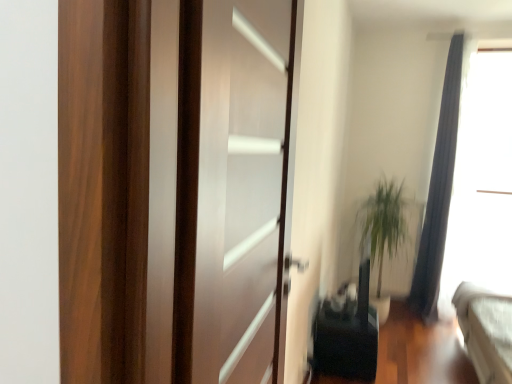
Question: Is green leafy plant at right touching black matte speaker at lower center?

Choices:
 (A) no
 (B) yes

Answer: (A)

Question: Is green leafy plant at right outside of black matte speaker at lower center?

Choices:
 (A) yes
 (B) no

Answer: (A)

Question: Would you say black matte speaker at lower center is part of green leafy plant at right's contents?

Choices:
 (A) yes
 (B) no

Answer: (B)

Question: Can you confirm if green leafy plant at right is shorter than black matte speaker at lower center?

Choices:
 (A) no
 (B) yes

Answer: (A)

Question: From the image's perspective, is green leafy plant at right below black matte speaker at lower center?

Choices:
 (A) yes
 (B) no

Answer: (B)

Question: Does green leafy plant at right appear on the left side of black matte speaker at lower center?

Choices:
 (A) yes
 (B) no

Answer: (B)

Question: Is silky gray curtain at right completely or partially outside of black matte speaker at lower center?

Choices:
 (A) yes
 (B) no

Answer: (A)

Question: From the image's perspective, is silky gray curtain at right above black matte speaker at lower center?

Choices:
 (A) no
 (B) yes

Answer: (B)

Question: Is the position of silky gray curtain at right more distant than that of black matte speaker at lower center?

Choices:
 (A) no
 (B) yes

Answer: (B)

Question: Is silky gray curtain at right positioned with its back to black matte speaker at lower center?

Choices:
 (A) yes
 (B) no

Answer: (B)

Question: Could you tell me if silky gray curtain at right is turned towards black matte speaker at lower center?

Choices:
 (A) yes
 (B) no

Answer: (B)

Question: Considering the relative positions of silky gray curtain at right and black matte speaker at lower center in the image provided, is silky gray curtain at right in front of black matte speaker at lower center?

Choices:
 (A) no
 (B) yes

Answer: (A)

Question: From the image's perspective, is transparent glass door at center below silky gray curtain at right?

Choices:
 (A) yes
 (B) no

Answer: (A)